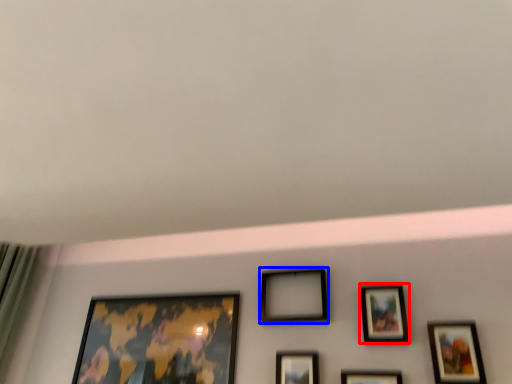
Question: Which point is further to the camera, picture frame (highlighted by a red box) or picture frame (highlighted by a blue box)?

Choices:
 (A) picture frame
 (B) picture frame

Answer: (B)